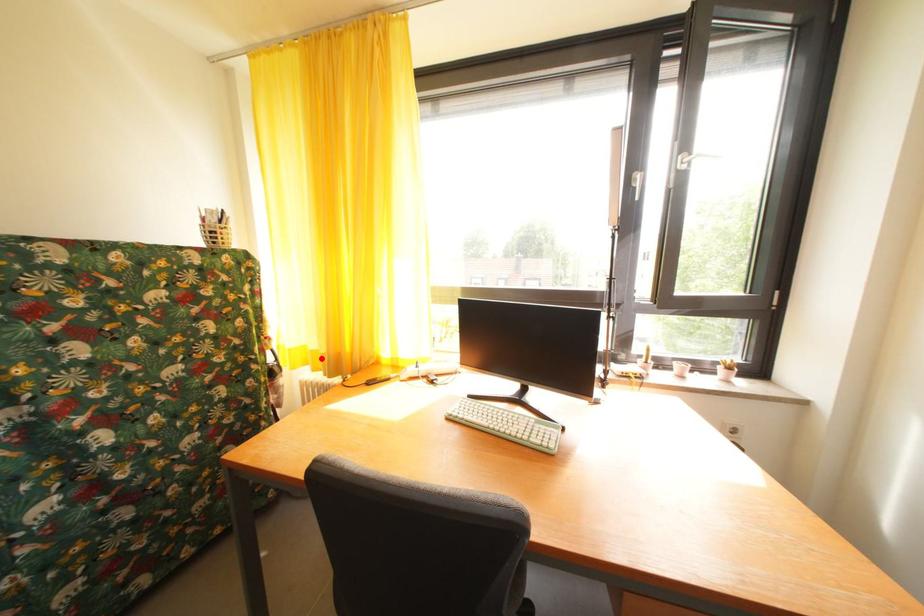
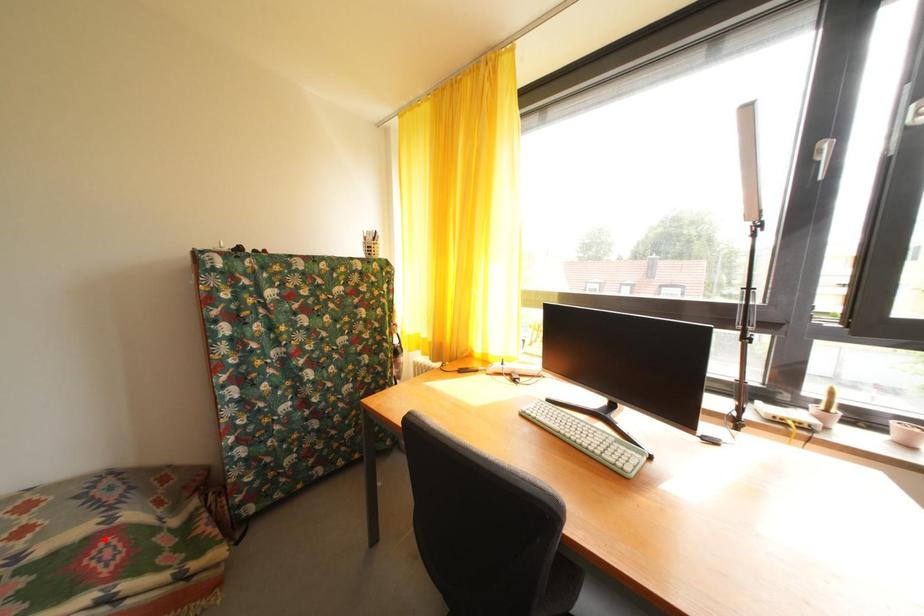
I am providing you with two images of the same scene from different viewpoints. A red point is marked on the first image and another point is marked on the second image. Does the point marked in image1 correspond to the same location as the one in image2?

No